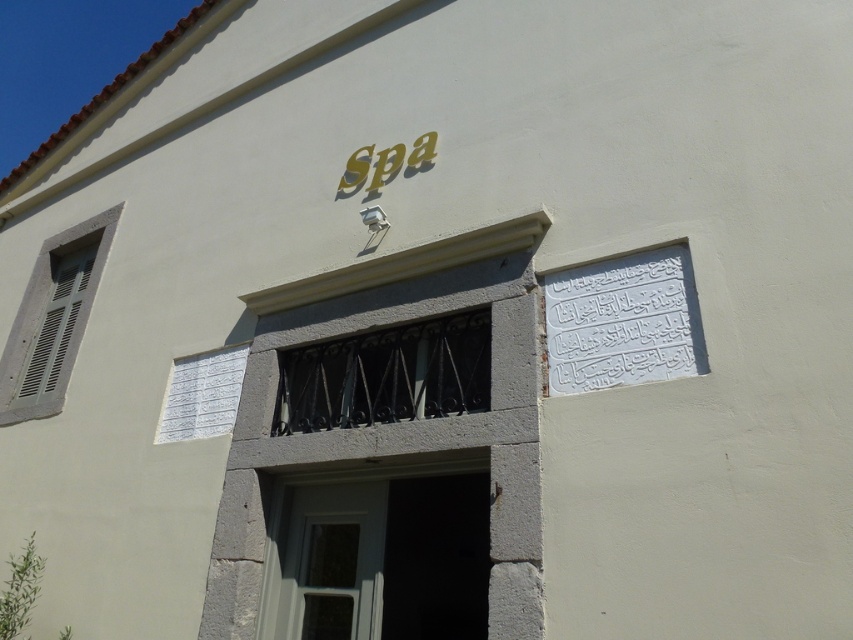
Question: Which point is closer to the camera?

Choices:
 (A) (566, 301)
 (B) (469, 561)

Answer: (A)

Question: Which of the following is the farthest from the observer?

Choices:
 (A) (457, 552)
 (B) (561, 284)

Answer: (A)

Question: Does white painted wood door at center appear under white carved stone plaque at upper right?

Choices:
 (A) yes
 (B) no

Answer: (A)

Question: Does white painted wood door at center lie behind white carved stone plaque at upper right?

Choices:
 (A) yes
 (B) no

Answer: (A)

Question: Is white painted wood door at center to the left of white carved stone plaque at upper right from the viewer's perspective?

Choices:
 (A) yes
 (B) no

Answer: (A)